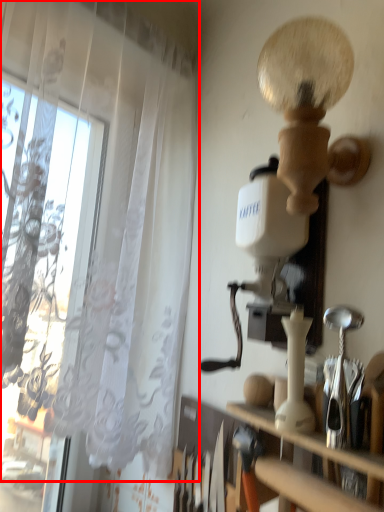
Question: From the image, what is the correct spatial relationship of curtain (annotated by the red box) in relation to shelf?

Choices:
 (A) right
 (B) left

Answer: (B)